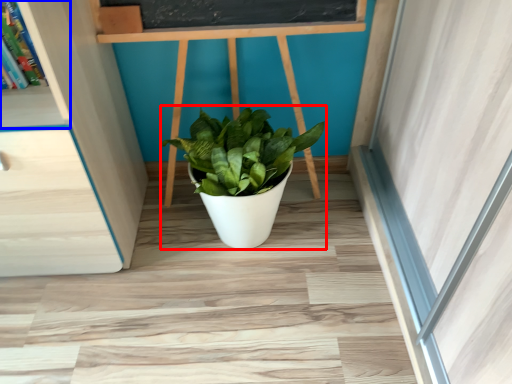
Question: Which object appears farthest to the camera in this image, houseplant (highlighted by a red box) or shelf (highlighted by a blue box)?

Choices:
 (A) houseplant
 (B) shelf

Answer: (A)